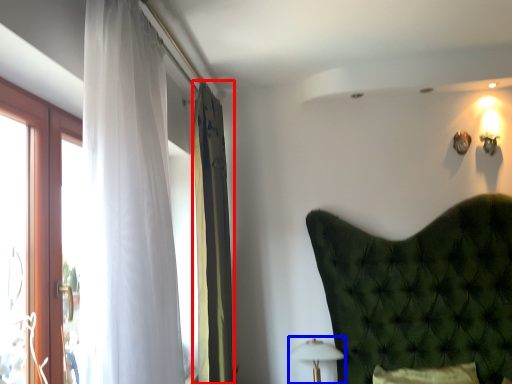
Question: Which object appears farthest to the camera in this image, curtain (highlighted by a red box) or table lamp (highlighted by a blue box)?

Choices:
 (A) curtain
 (B) table lamp

Answer: (B)